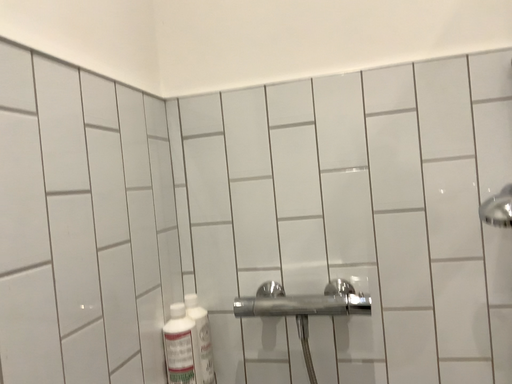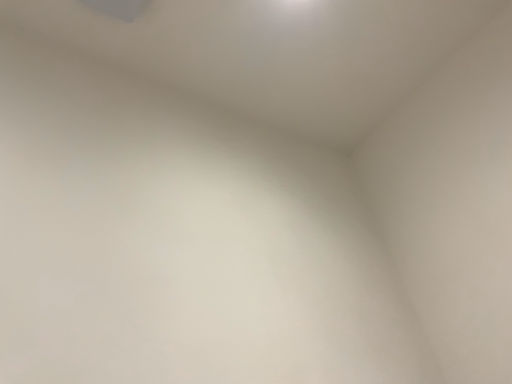
Question: Which way did the camera rotate in the video?

Choices:
 (A) rotated downward
 (B) rotated upward

Answer: (B)